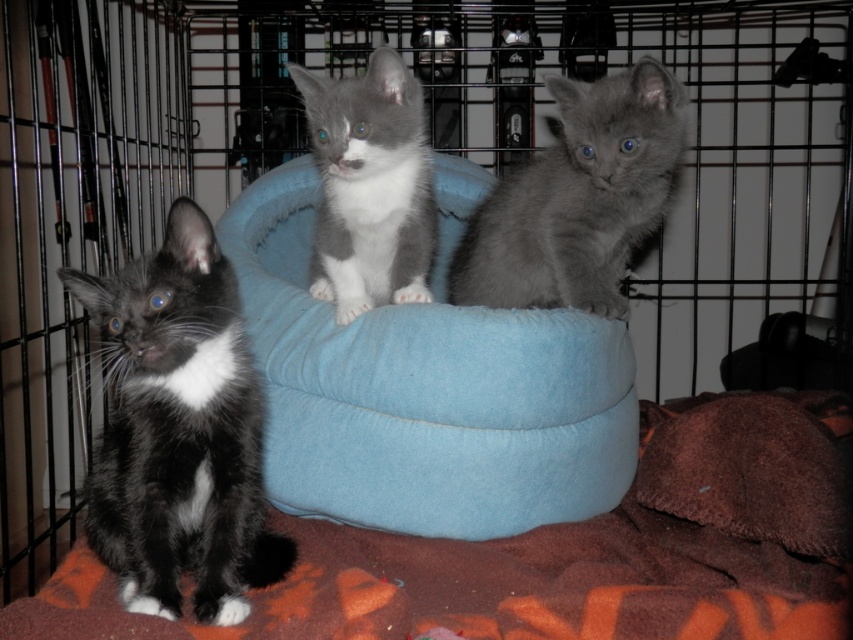
Question: Which object is the farthest from the gray fluffy kitten at center?

Choices:
 (A) orange fleece blanket at lower left
 (B) gray soft fur kitten at center
 (C) black soft fur cat at left
 (D) blue fabric cat bed at center

Answer: (C)

Question: Which point appears farthest from the camera in this image?

Choices:
 (A) (544, 173)
 (B) (363, 253)

Answer: (B)

Question: Is black soft fur cat at left behind gray soft fur kitten at center?

Choices:
 (A) no
 (B) yes

Answer: (A)

Question: Is black soft fur cat at left wider than gray soft fur kitten at center?

Choices:
 (A) yes
 (B) no

Answer: (A)

Question: Among these objects, which one is nearest to the camera?

Choices:
 (A) orange fleece blanket at lower left
 (B) black soft fur cat at left

Answer: (A)

Question: Does blue fabric cat bed at center lie in front of gray fluffy kitten at center?

Choices:
 (A) yes
 (B) no

Answer: (A)